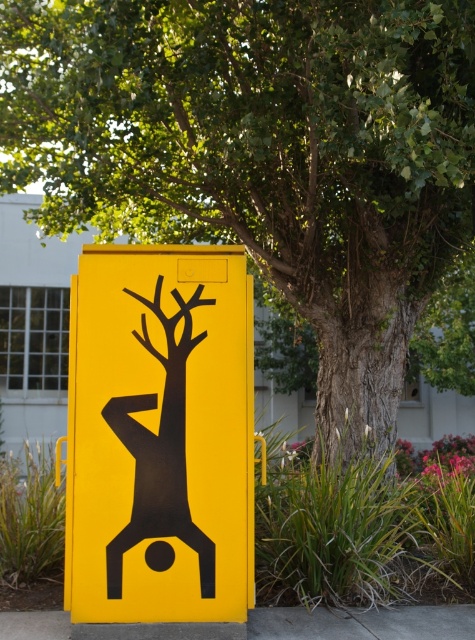
Question: Among these points, which one is farthest from the camera?

Choices:
 (A) (92, 604)
 (B) (443, 612)

Answer: (B)

Question: Is matte yellow sign at center further to camera compared to concrete at center?

Choices:
 (A) yes
 (B) no

Answer: (B)

Question: Which point is closer to the camera taking this photo?

Choices:
 (A) (252, 612)
 (B) (74, 387)

Answer: (B)

Question: Is matte yellow sign at center to the right of concrete at center from the viewer's perspective?

Choices:
 (A) no
 (B) yes

Answer: (A)

Question: Can you confirm if matte yellow sign at center is wider than concrete at center?

Choices:
 (A) no
 (B) yes

Answer: (A)